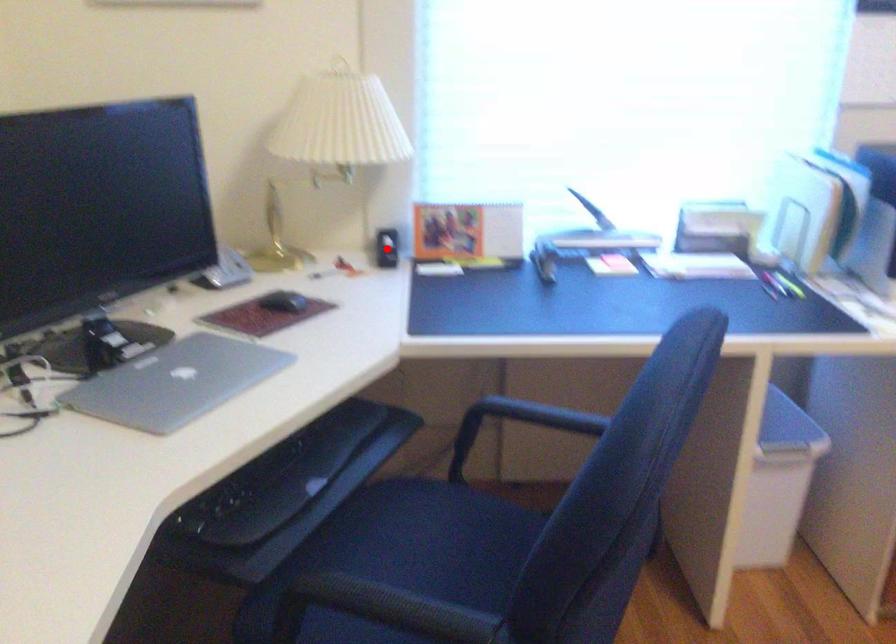
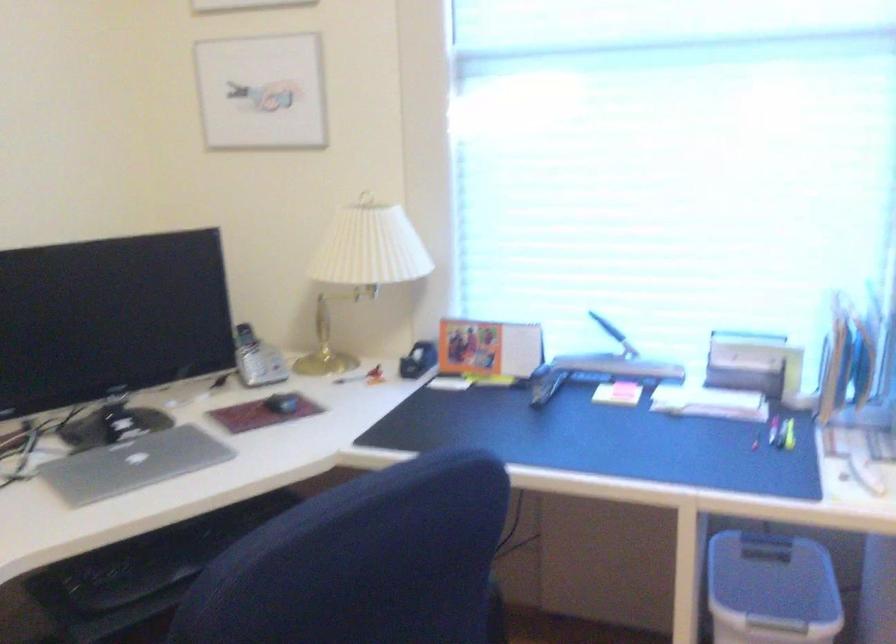
Question: I am providing you with two images of the same scene from different viewpoints. Image1 has a red point marked. In image2, the corresponding 3D location appears at what relative position? Reply with the corresponding letter.

Choices:
 (A) Closer
 (B) Farther

Answer: (B)